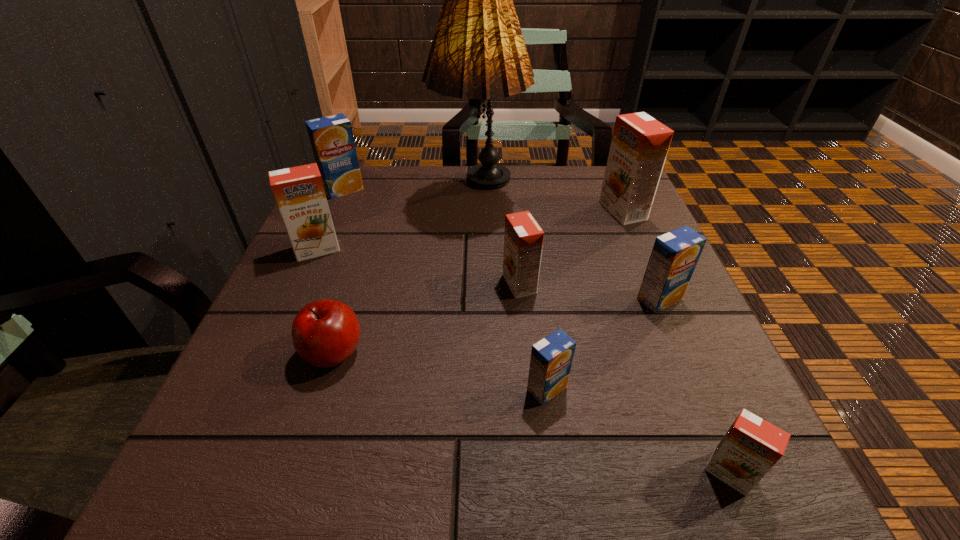
The image size is (960, 540). I want to click on object located at the near right corner, so click(751, 447).

The height and width of the screenshot is (540, 960). Find the location of `vacant area at the far edge`. vacant area at the far edge is located at coordinates (566, 185).

Where is `vacant space at the near edge of the desktop`? Image resolution: width=960 pixels, height=540 pixels. vacant space at the near edge of the desktop is located at coordinates (582, 464).

The image size is (960, 540). Find the location of `free space at the left edge of the desktop`. free space at the left edge of the desktop is located at coordinates (309, 391).

Find the location of a particular element. The width and height of the screenshot is (960, 540). vacant area at the right edge is located at coordinates (634, 323).

Where is `free space at the near left corner`? The height and width of the screenshot is (540, 960). free space at the near left corner is located at coordinates (273, 446).

At what (x,y) coordinates should I click in order to perform the action: click on vacant space at the far right corner of the desktop. Please return your answer as a coordinate pair (x, y). The image size is (960, 540). Looking at the image, I should click on (583, 184).

Locate an element on the screen. The width and height of the screenshot is (960, 540). vacant point located between the tallest object and the third farthest orange orange juice is located at coordinates (499, 239).

Image resolution: width=960 pixels, height=540 pixels. I want to click on vacant area that lies between the second blue orange_juice from right to left and the third farthest orange orange juice, so click(533, 336).

Where is `free space between the third farthest orange orange juice and the third nearest orange orange juice`? free space between the third farthest orange orange juice and the third nearest orange orange juice is located at coordinates (419, 266).